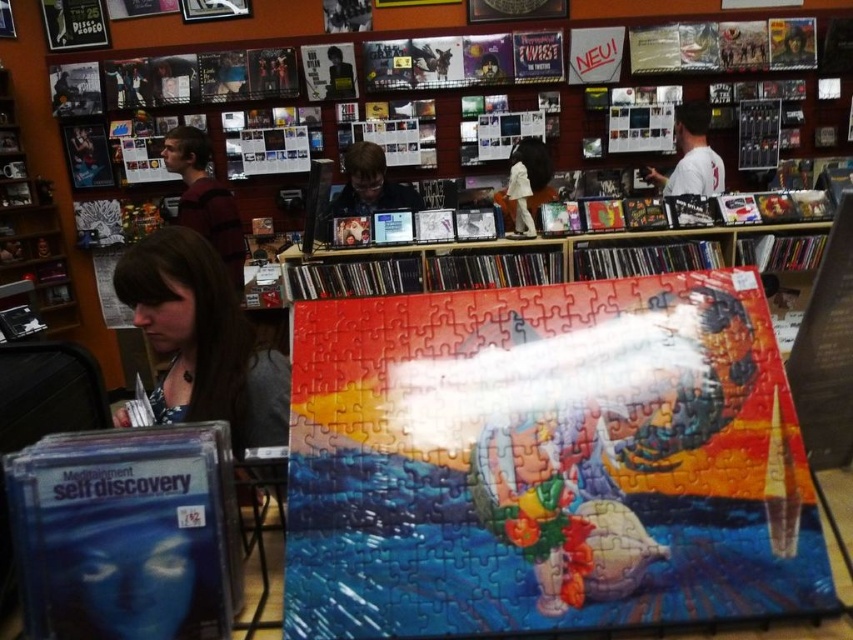
Question: Observing the image, what is the correct spatial positioning of white cotton shirt at upper right in reference to white fabric dress at center?

Choices:
 (A) above
 (B) below

Answer: (A)

Question: Based on their relative distances, which object is nearer to the wooden bookshelf at upper left?

Choices:
 (A) white cotton shirt at upper right
 (B) matte black shirt at upper center
 (C) white fabric dress at center
 (D) maroon sweater at upper left

Answer: (D)

Question: Considering the relative positions of matte black shirt at center and white fabric dress at center in the image provided, where is matte black shirt at center located with respect to white fabric dress at center?

Choices:
 (A) above
 (B) below

Answer: (A)

Question: Estimate the real-world distances between objects in this image. Which object is closer to the matte black shirt at center?

Choices:
 (A) white fabric dress at center
 (B) matte black shirt at upper center
 (C) white cotton shirt at upper right

Answer: (A)

Question: Which object appears farthest from the camera in this image?

Choices:
 (A) wooden bookshelf at upper left
 (B) matte black shirt at upper center
 (C) maroon sweater at upper left
 (D) white cotton shirt at upper right

Answer: (B)

Question: Observing the image, what is the correct spatial positioning of matte black shirt at center in reference to matte black shirt at upper center?

Choices:
 (A) above
 (B) below

Answer: (B)